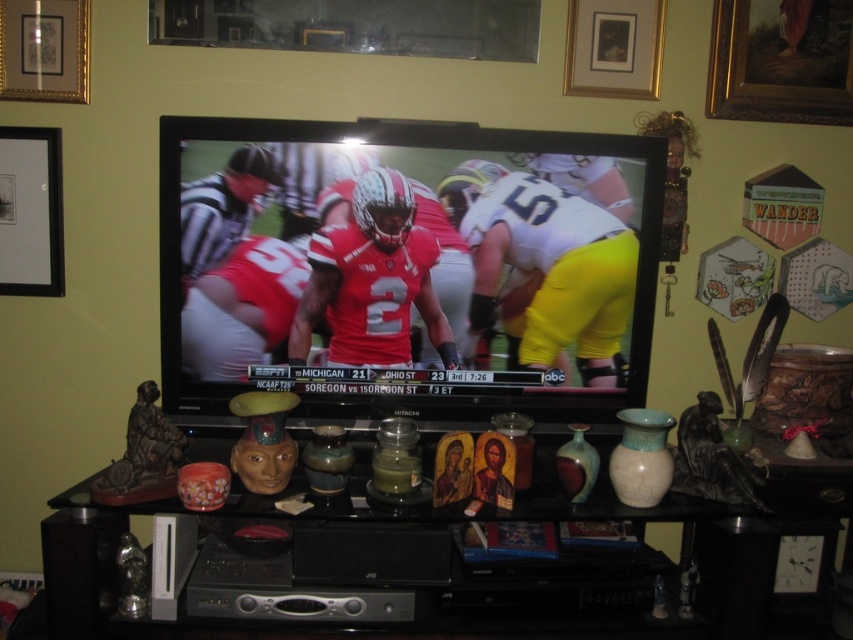
Question: Among these points, which one is nearest to the camera?

Choices:
 (A) (x=642, y=32)
 (B) (x=30, y=273)

Answer: (B)

Question: Is black matte picture frame at upper left in front of gold-framed picture at upper center?

Choices:
 (A) no
 (B) yes

Answer: (B)

Question: Considering the real-world distances, which object is farthest from the goldframed painting at upper right?

Choices:
 (A) matte black television at center
 (B) matte ceramic mask at center

Answer: (B)

Question: Does goldframed painting at upper right have a lesser width compared to black matte picture frame at upper left?

Choices:
 (A) yes
 (B) no

Answer: (B)

Question: Is goldframed painting at upper right wider than black matte picture frame at upper left?

Choices:
 (A) no
 (B) yes

Answer: (B)

Question: Which object is the closest to the matte black television at center?

Choices:
 (A) gold-framed picture at upper center
 (B) black matte picture frame at upper left
 (C) gold-framed picture at upper left
 (D) goldframed painting at upper right

Answer: (A)